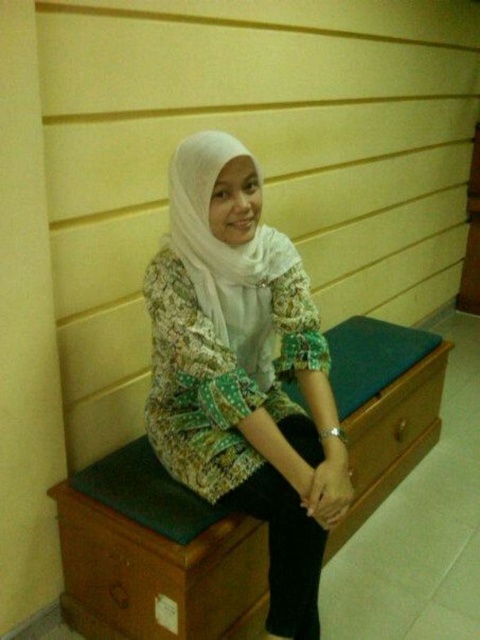
You are an interior designer assessing the space. You have a decorative item that is 10 cm thick. You want to place it on the surface between the white sheer headscarf at center and the green fabric drawer at center. Will it fit based on the available space?

The white sheer headscarf at center is thinner than the green fabric drawer at center. Since the decorative item is 10 cm thick, it may fit if the space between them is at least 10 cm. However, the exact dimensions of the space aren